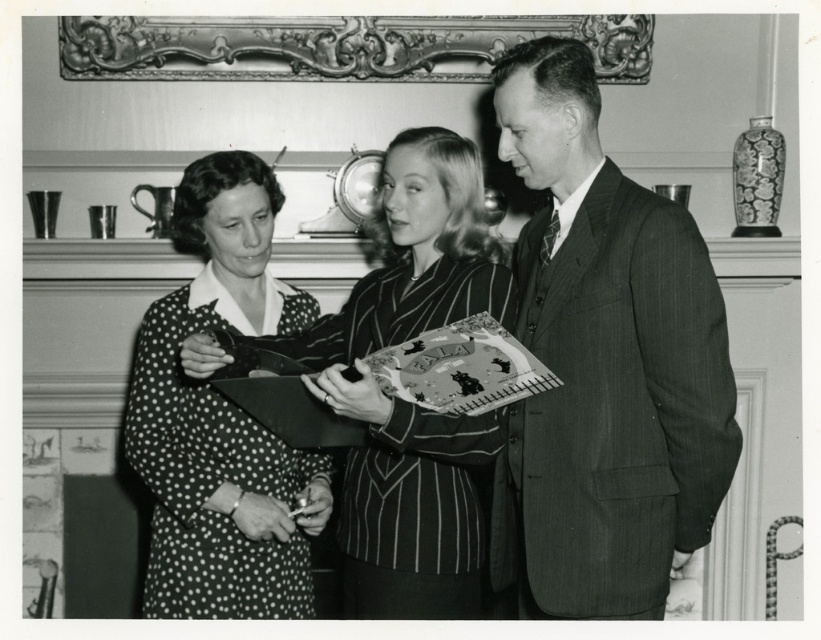
In the formal indoor setting, you need to determine the spatial relationship between the textured pinstripe suit at right and the gold ornate picture frame at upper center. Which object is closer to the viewer?

The textured pinstripe suit at right is closer to the viewer as it is positioned in front of the gold ornate picture frame at upper center.

You are a fashion designer observing the image. You need to determine which garment has a narrower width between the textured pinstripe suit at right and the polka dot fabric dress at center. Which one is narrower?

The textured pinstripe suit at right has a narrower width compared to the polka dot fabric dress at center as stated in the description.

You are an interior designer assessing the layout of this formal indoor setting. You need to determine if the textured pinstripe suit at right will fit under the gold ornate picture frame at upper center without overlapping. Based on their sizes, can it be done?

The textured pinstripe suit at right is taller than the gold ornate picture frame at upper center, so it cannot fit under the frame without overlapping.